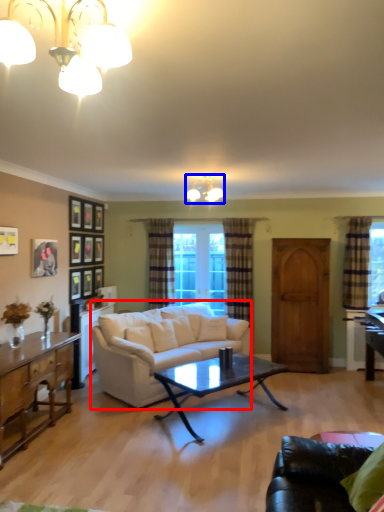
Question: Which object appears farthest to the camera in this image, studio couch (highlighted by a red box) or lamp (highlighted by a blue box)?

Choices:
 (A) studio couch
 (B) lamp

Answer: (B)